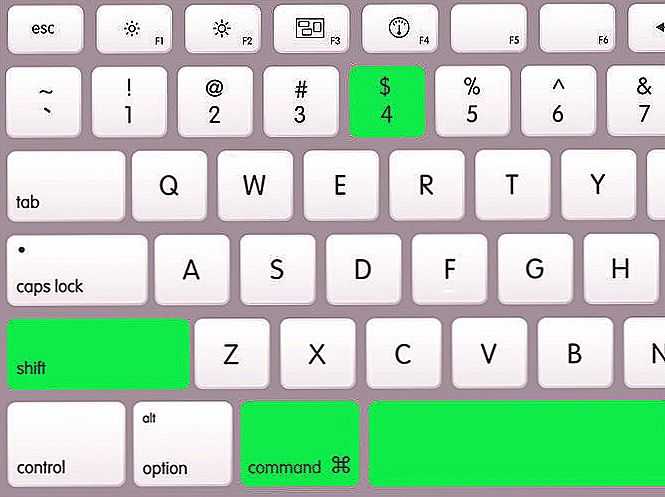
Identify the location of keyboard buttons highlighted green. The image size is (665, 497). (527, 453), (269, 436), (84, 344), (378, 111).